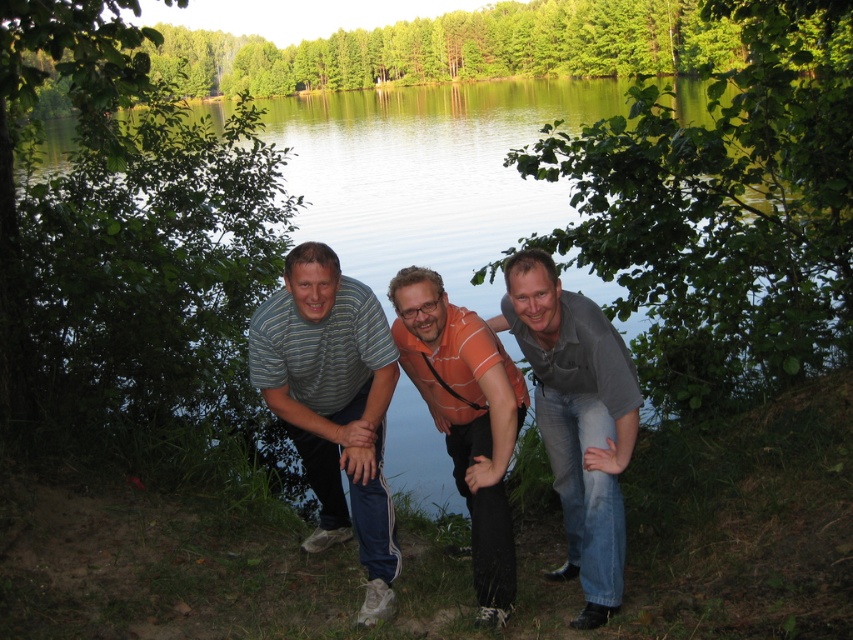
Question: Is the position of gray matte shirt at center more distant than that of orange striped shirt at center?

Choices:
 (A) no
 (B) yes

Answer: (A)

Question: Which of the following is the closest to the observer?

Choices:
 (A) green water at center
 (B) gray matte shirt at center
 (C) striped cotton shirt at center

Answer: (B)

Question: Is green water at center positioned before gray matte shirt at center?

Choices:
 (A) yes
 (B) no

Answer: (B)

Question: Can you confirm if green water at center is positioned below gray matte shirt at center?

Choices:
 (A) yes
 (B) no

Answer: (B)

Question: Which object is closer to the camera taking this photo?

Choices:
 (A) striped cotton shirt at center
 (B) gray matte shirt at center

Answer: (B)

Question: Which of the following is the farthest from the observer?

Choices:
 (A) green water at center
 (B) orange striped shirt at center
 (C) striped cotton shirt at center
 (D) gray matte shirt at center

Answer: (A)